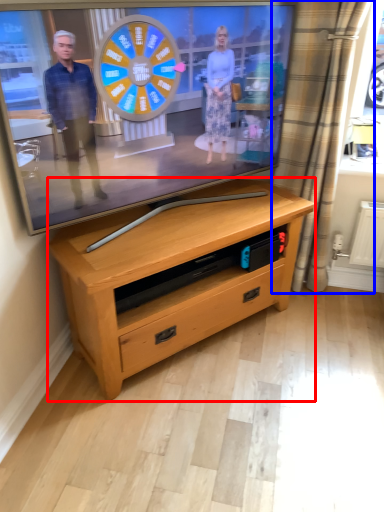
Question: Which of the following is the farthest to the observer, chest of drawers (highlighted by a red box) or curtain (highlighted by a blue box)?

Choices:
 (A) chest of drawers
 (B) curtain

Answer: (B)